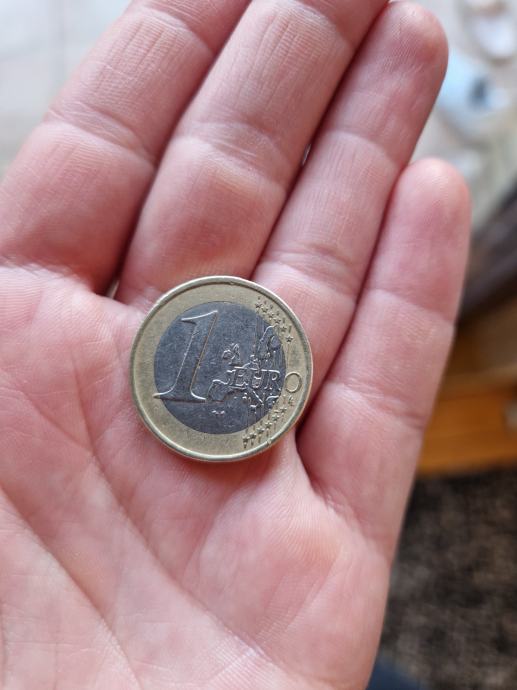
The height and width of the screenshot is (690, 517). What are the coordinates of `wood floor` in the screenshot? It's located at (468, 448).